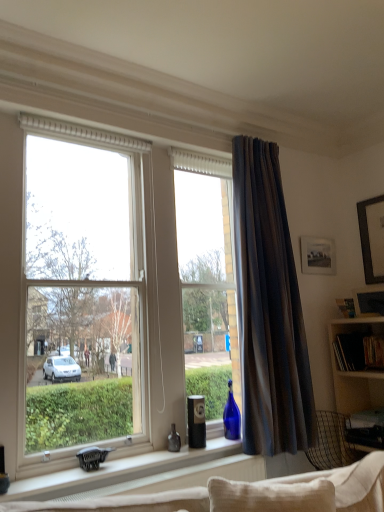
Find the location of `wooden picture frame at upper right, the 2th picture frame in the top-to-bottom sequence`. wooden picture frame at upper right, the 2th picture frame in the top-to-bottom sequence is located at coordinates (369, 300).

In order to face metallic silver desk at lower right, should I rotate leftwards or rightwards?

You should rotate right by 23.717 degrees.

What is the approximate width of metallic silver desk at lower right?

metallic silver desk at lower right is 17.35 inches in width.

The height and width of the screenshot is (512, 384). What do you see at coordinates (269, 309) in the screenshot? I see `dark grey textured curtain at right` at bounding box center [269, 309].

How much space does matte black picture frame at upper right, placed as the 1th picture frame when sorted from back to front, occupy horizontally?

1.93 inches.

Find the location of a particular element. matte glass bottle at window sill is located at coordinates (174, 440).

In the image, there is a dark grey textured curtain at right. Find the location of `picture frame below it (from a real-world perspective)`. picture frame below it (from a real-world perspective) is located at coordinates (369, 300).

In the image, is dark grey textured curtain at right positioned in front of or behind wooden picture frame at upper right, the 2th picture frame in the top-to-bottom sequence?

Clearly, dark grey textured curtain at right is in front of wooden picture frame at upper right, the 2th picture frame in the top-to-bottom sequence.

Which is more to the left, dark grey textured curtain at right or wooden picture frame at upper right, the first picture frame positioned from the bottom?

From the viewer's perspective, dark grey textured curtain at right appears more on the left side.

Can we say dark grey textured curtain at right lies outside wooden picture frame at upper right, the 2th picture frame in the top-to-bottom sequence?

Yes, dark grey textured curtain at right is located beyond the bounds of wooden picture frame at upper right, the 2th picture frame in the top-to-bottom sequence.

Is matte black picture frame at upper right, which is the 2th picture frame in front-to-back order, looking in the opposite direction of metallic silver desk at lower right?

No, matte black picture frame at upper right, which is the 2th picture frame in front-to-back order, is not facing the opposite direction of metallic silver desk at lower right.

The image size is (384, 512). What are the coordinates of `the 2nd picture frame directly above the metallic silver desk at lower right (from a real-world perspective)` in the screenshot? It's located at (317, 255).

Who is shorter, matte black picture frame at upper right, which is the 2th picture frame in front-to-back order, or metallic silver desk at lower right?

Standing shorter between the two is metallic silver desk at lower right.

Who is more distant, metallic silver desk at lower right or transparent glass window at center?

metallic silver desk at lower right.

Is point (375, 448) farther from camera compared to point (122, 180)?

Yes, it is behind point (122, 180).

Locate an element on the screen. This screenshot has height=512, width=384. window located in front of the metallic silver desk at lower right is located at coordinates pyautogui.click(x=117, y=294).

Considering the sizes of objects metallic silver desk at lower right and transparent glass window at center in the image provided, who is taller, metallic silver desk at lower right or transparent glass window at center?

transparent glass window at center is taller.

Locate an element on the screen. This screenshot has height=512, width=384. desk on the right of matte black picture frame at upper right, which appears as the 2th picture frame when ordered from the bottom is located at coordinates (366, 429).

Between point (375, 432) and point (300, 247), which one is positioned behind?

Positioned behind is point (300, 247).

Considering the sizes of objects metallic silver desk at lower right and matte black picture frame at upper right, which appears as the 2th picture frame when ordered from the bottom, in the image provided, who is taller, metallic silver desk at lower right or matte black picture frame at upper right, which appears as the 2th picture frame when ordered from the bottom,?

matte black picture frame at upper right, which appears as the 2th picture frame when ordered from the bottom, is taller.

From the picture: Considering the relative positions of metallic silver desk at lower right and matte black picture frame at upper right, which is the 2th picture frame in front-to-back order, in the image provided, is metallic silver desk at lower right behind matte black picture frame at upper right, which is the 2th picture frame in front-to-back order,?

No, metallic silver desk at lower right is in front of matte black picture frame at upper right, which is the 2th picture frame in front-to-back order.

Can you see dark grey textured curtain at right touching matte black picture frame at upper right, which is the 2th picture frame in front-to-back order?

They are not placed beside each other.

Between dark grey textured curtain at right and matte black picture frame at upper right, placed as the 1th picture frame when sorted from back to front, which one appears on the left side from the viewer's perspective?

dark grey textured curtain at right.

Is the position of dark grey textured curtain at right more distant than that of matte black picture frame at upper right, positioned as the 1th picture frame in top-to-bottom order?

No, it is not.

From the picture: Is dark grey textured curtain at right shorter than matte black picture frame at upper right, which appears as the 2th picture frame when ordered from the bottom?

In fact, dark grey textured curtain at right may be taller than matte black picture frame at upper right, which appears as the 2th picture frame when ordered from the bottom.

How many degrees apart are the facing directions of matte glass bottle at window sill and metallic silver desk at lower right?

matte glass bottle at window sill and metallic silver desk at lower right are facing 83.8 degrees away from each other.

From the image's perspective, between matte glass bottle at window sill and metallic silver desk at lower right, which one is located above?

From the image's view, matte glass bottle at window sill is above.

Would you consider matte glass bottle at window sill to be distant from metallic silver desk at lower right?

Yes, matte glass bottle at window sill and metallic silver desk at lower right are located far from each other.

Looking at this image, is matte glass bottle at window sill facing away from metallic silver desk at lower right?

That's not correct — matte glass bottle at window sill is not looking away from metallic silver desk at lower right.

Can metallic silver desk at lower right be found inside white matte window sill at center?

No, metallic silver desk at lower right is located outside of white matte window sill at center.

Considering the positions of objects white matte window sill at center and metallic silver desk at lower right in the image provided, who is in front, white matte window sill at center or metallic silver desk at lower right?

white matte window sill at center is in front.

Is white matte window sill at center oriented away from metallic silver desk at lower right?

No, white matte window sill at center's orientation is not away from metallic silver desk at lower right.

Who is taller, white matte window sill at center or metallic silver desk at lower right?

metallic silver desk at lower right is taller.

At what (x,y) coordinates should I click in order to perform the action: click on curtain above the wooden picture frame at upper right, the 2th picture frame in the top-to-bottom sequence (from a real-world perspective). Please return your answer as a coordinate pair (x, y). Looking at the image, I should click on (269, 309).

Which picture frame is the 2nd one when counting from the left side of the metallic silver desk at lower right? Please provide its 2D coordinates.

[(317, 255)]

Which object lies nearer to the anchor point matte black picture frame at upper right, placed as the 1th picture frame when sorted from back to front, transparent glass window at center or dark grey textured curtain at right?

dark grey textured curtain at right.

Estimate the real-world distances between objects in this image. Which object is closer to white matte window sill at center, transparent glass window at center or wooden picture frame at upper right, the first picture frame positioned from the bottom?

The object closer to white matte window sill at center is transparent glass window at center.

From the image, which object appears to be farther from wooden picture frame at upper right, the first picture frame positioned from the bottom, transparent glass window at center or metallic silver desk at lower right?

transparent glass window at center.

From the image, which object appears to be farther from white matte window sill at center, matte black picture frame at upper right, which appears as the 2th picture frame when ordered from the bottom, or dark grey textured curtain at right?

matte black picture frame at upper right, which appears as the 2th picture frame when ordered from the bottom, lies further to white matte window sill at center than the other object.

Which object lies further to the anchor point dark grey textured curtain at right, white matte window sill at center or metallic silver desk at lower right?

metallic silver desk at lower right is positioned further to the anchor dark grey textured curtain at right.

Considering their positions, is white matte window sill at center positioned closer to dark grey textured curtain at right than transparent glass window at center?

transparent glass window at center lies closer to dark grey textured curtain at right than the other object.

Looking at the image, which one is located closer to metallic silver desk at lower right, transparent glass window at center or dark grey textured curtain at right?

dark grey textured curtain at right.

When comparing their distances from matte glass bottle at window sill, does white matte window sill at center or matte black picture frame at upper right, positioned as the 1th picture frame in top-to-bottom order, seem further?

matte black picture frame at upper right, positioned as the 1th picture frame in top-to-bottom order.

Locate an element on the screen. The image size is (384, 512). bottle between dark grey textured curtain at right and white matte window sill at center from top to bottom is located at coordinates (174, 440).

This screenshot has width=384, height=512. What are the coordinates of `picture frame between matte black picture frame at upper right, which appears as the 2th picture frame when ordered from the bottom, and metallic silver desk at lower right vertically` in the screenshot? It's located at (369, 300).

At what (x,y) coordinates should I click in order to perform the action: click on curtain situated between transparent glass window at center and wooden picture frame at upper right, acting as the second picture frame starting from the back, from left to right. Please return your answer as a coordinate pair (x, y). Looking at the image, I should click on (269, 309).

Identify the location of bottle situated between white matte window sill at center and wooden picture frame at upper right, acting as the second picture frame starting from the back, from left to right. (174, 440).